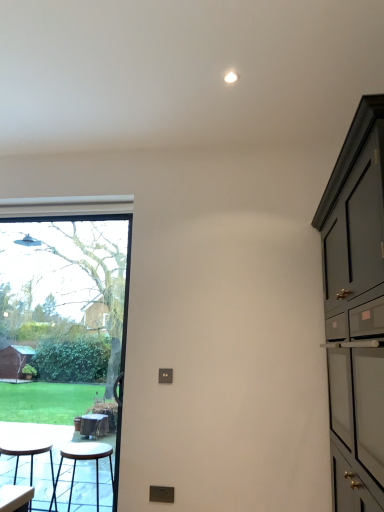
I want to click on matte black stool at lower left, which is the second stool from right to left, so click(x=29, y=455).

Identify the location of metallic stool at lower left, which is the 1th stool from right to left. The height and width of the screenshot is (512, 384). (84, 460).

Where is `matte dark green cabinet at right`? matte dark green cabinet at right is located at coordinates (356, 310).

Measure the distance between matte dark green cabinet at right and camera.

matte dark green cabinet at right and camera are 4.42 feet apart.

Where is `matte black stool at lower left, positioned as the 1th stool in left-to-right order`? Image resolution: width=384 pixels, height=512 pixels. matte black stool at lower left, positioned as the 1th stool in left-to-right order is located at coordinates (29, 455).

Is the surface of transparent glass window at left in direct contact with matte black stool at lower left, which is the second stool from right to left?

They are not placed beside each other.

Which is more to the left, transparent glass window at left or matte black stool at lower left, positioned as the 1th stool in left-to-right order?

Positioned to the left is matte black stool at lower left, positioned as the 1th stool in left-to-right order.

Is transparent glass window at left looking in the opposite direction of matte black stool at lower left, which is the second stool from right to left?

Yes, transparent glass window at left is positioned with its back facing matte black stool at lower left, which is the second stool from right to left.

Does point (0, 247) appear closer or farther from the camera than point (44, 446)?

Point (0, 247).

Between point (0, 449) and point (96, 481), which one is positioned behind?

The point (96, 481) is behind.

Considering the sizes of objects matte black stool at lower left, positioned as the 1th stool in left-to-right order, and metallic stool at lower left, which is the 1th stool from right to left, in the image provided, who is taller, matte black stool at lower left, positioned as the 1th stool in left-to-right order, or metallic stool at lower left, which is the 1th stool from right to left,?

matte black stool at lower left, positioned as the 1th stool in left-to-right order.

Is metallic stool at lower left, which is the 1th stool from right to left, completely or partially inside matte black stool at lower left, which is the second stool from right to left?

No, metallic stool at lower left, which is the 1th stool from right to left, is not a part of matte black stool at lower left, which is the second stool from right to left.

Is metallic stool at lower left, which is the 1th stool from right to left, completely or partially inside transparent glass window at left?

That's incorrect, metallic stool at lower left, which is the 1th stool from right to left, is not inside transparent glass window at left.

Which stool is the 2nd one when counting from the front of the transparent glass window at left? Please provide its 2D coordinates.

[(84, 460)]

Which object is positioned more to the left, transparent glass window at left or metallic stool at lower left, which is the 1th stool from right to left?

transparent glass window at left.

Which point is more distant from viewer, (99, 458) or (31, 456)?

Positioned behind is point (99, 458).

Considering the relative sizes of metallic stool at lower left, which is the 1th stool from right to left, and matte black stool at lower left, positioned as the 1th stool in left-to-right order, in the image provided, is metallic stool at lower left, which is the 1th stool from right to left, bigger than matte black stool at lower left, positioned as the 1th stool in left-to-right order,?

No, metallic stool at lower left, which is the 1th stool from right to left, is not bigger than matte black stool at lower left, positioned as the 1th stool in left-to-right order.

From the image's perspective, which is below, metallic stool at lower left, which is the 1th stool from right to left, or matte black stool at lower left, which is the second stool from right to left?

From the image's view, matte black stool at lower left, which is the second stool from right to left, is below.

Could you tell me if metallic stool at lower left, marked as the 2th stool in a left-to-right arrangement, is facing matte black stool at lower left, which is the second stool from right to left?

No, metallic stool at lower left, marked as the 2th stool in a left-to-right arrangement, is not oriented towards matte black stool at lower left, which is the second stool from right to left.

Does matte dark green cabinet at right have a greater width compared to metallic stool at lower left, marked as the 2th stool in a left-to-right arrangement?

Correct, the width of matte dark green cabinet at right exceeds that of metallic stool at lower left, marked as the 2th stool in a left-to-right arrangement.

In the scene shown: Considering the sizes of objects matte dark green cabinet at right and metallic stool at lower left, marked as the 2th stool in a left-to-right arrangement, in the image provided, who is taller, matte dark green cabinet at right or metallic stool at lower left, marked as the 2th stool in a left-to-right arrangement,?

Standing taller between the two is matte dark green cabinet at right.

Considering the sizes of objects metallic stool at lower left, which is the 1th stool from right to left, and matte dark green cabinet at right in the image provided, who is wider, metallic stool at lower left, which is the 1th stool from right to left, or matte dark green cabinet at right?

With larger width is matte dark green cabinet at right.

Which of these two, metallic stool at lower left, which is the 1th stool from right to left, or matte dark green cabinet at right, is smaller?

metallic stool at lower left, which is the 1th stool from right to left, is smaller.

Which of these two, metallic stool at lower left, which is the 1th stool from right to left, or matte dark green cabinet at right, stands taller?

Standing taller between the two is matte dark green cabinet at right.

From a real-world perspective, between metallic stool at lower left, which is the 1th stool from right to left, and matte dark green cabinet at right, who is vertically higher?

In real-world perspective, matte dark green cabinet at right is above.

Is transparent glass window at left inside the boundaries of matte dark green cabinet at right, or outside?

transparent glass window at left exists outside the volume of matte dark green cabinet at right.

Is transparent glass window at left to the left or to the right of matte dark green cabinet at right in the image?

Clearly, transparent glass window at left is on the left of matte dark green cabinet at right in the image.

Between transparent glass window at left and matte dark green cabinet at right, which one has more height?

With more height is transparent glass window at left.

The width and height of the screenshot is (384, 512). Find the location of `window behind the matte black stool at lower left, which is the second stool from right to left`. window behind the matte black stool at lower left, which is the second stool from right to left is located at coordinates (67, 292).

Locate an element on the screen. The height and width of the screenshot is (512, 384). stool that is below the metallic stool at lower left, marked as the 2th stool in a left-to-right arrangement (from the image's perspective) is located at coordinates (29, 455).

From the image, which object appears to be nearer to matte black stool at lower left, positioned as the 1th stool in left-to-right order, metallic stool at lower left, which is the 1th stool from right to left, or transparent glass window at left?

Based on the image, metallic stool at lower left, which is the 1th stool from right to left, appears to be nearer to matte black stool at lower left, positioned as the 1th stool in left-to-right order.

Which object lies further to the anchor point transparent glass window at left, metallic stool at lower left, which is the 1th stool from right to left, or matte black stool at lower left, positioned as the 1th stool in left-to-right order?

Among the two, matte black stool at lower left, positioned as the 1th stool in left-to-right order, is located further to transparent glass window at left.

When comparing their distances from matte dark green cabinet at right, does metallic stool at lower left, which is the 1th stool from right to left, or matte black stool at lower left, which is the second stool from right to left, seem closer?

The object closer to matte dark green cabinet at right is metallic stool at lower left, which is the 1th stool from right to left.

Looking at this image, when comparing their distances from matte black stool at lower left, which is the second stool from right to left, does transparent glass window at left or matte dark green cabinet at right seem closer?

The object closer to matte black stool at lower left, which is the second stool from right to left, is transparent glass window at left.

Considering their positions, is transparent glass window at left positioned further to matte dark green cabinet at right than metallic stool at lower left, which is the 1th stool from right to left?

transparent glass window at left lies further to matte dark green cabinet at right than the other object.

Based on their spatial positions, is matte dark green cabinet at right or transparent glass window at left closer to matte black stool at lower left, which is the second stool from right to left?

transparent glass window at left.

From the image, which object appears to be farther from metallic stool at lower left, which is the 1th stool from right to left, transparent glass window at left or matte black stool at lower left, positioned as the 1th stool in left-to-right order?

transparent glass window at left is further to metallic stool at lower left, which is the 1th stool from right to left.

Considering their positions, is matte dark green cabinet at right positioned closer to matte black stool at lower left, which is the second stool from right to left, than metallic stool at lower left, marked as the 2th stool in a left-to-right arrangement?

metallic stool at lower left, marked as the 2th stool in a left-to-right arrangement.

This screenshot has width=384, height=512. I want to click on stool located between matte black stool at lower left, which is the second stool from right to left, and matte dark green cabinet at right in the left-right direction, so click(x=84, y=460).

In order to click on stool situated between transparent glass window at left and matte dark green cabinet at right from left to right in this screenshot , I will do `click(84, 460)`.

At what (x,y) coordinates should I click in order to perform the action: click on window between matte black stool at lower left, which is the second stool from right to left, and matte dark green cabinet at right from left to right. Please return your answer as a coordinate pair (x, y). This screenshot has height=512, width=384. Looking at the image, I should click on (67, 292).

Find the location of a particular element. The image size is (384, 512). stool that lies between transparent glass window at left and matte black stool at lower left, positioned as the 1th stool in left-to-right order, from top to bottom is located at coordinates (84, 460).